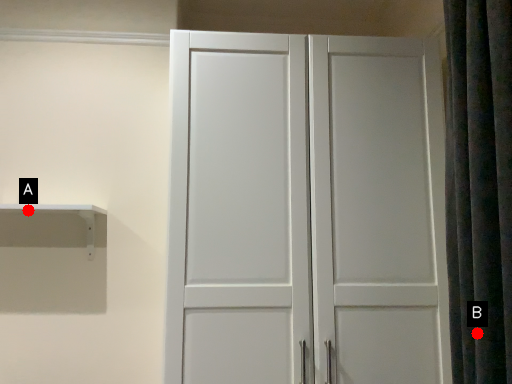
Question: Two points are circled on the image, labeled by A and B beside each circle. Which point appears farthest from the camera in this image?

Choices:
 (A) A is further
 (B) B is further

Answer: (A)